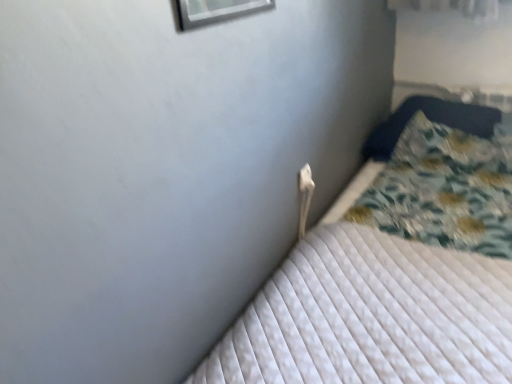
Question: Looking at their shapes, would you say fluffy blue pillow at right is wider or thinner than white plastic electric outlet at upper center?

Choices:
 (A) thin
 (B) wide

Answer: (B)

Question: Does point (418, 104) appear closer or farther from the camera than point (302, 183)?

Choices:
 (A) farther
 (B) closer

Answer: (A)

Question: Estimate the real-world distances between objects in this image. Which object is farther from the white plastic electric outlet at upper center?

Choices:
 (A) fluffy blue pillow at right
 (B) white quilted mattress at center

Answer: (A)

Question: Which object is the farthest from the white quilted mattress at center?

Choices:
 (A) white plastic electric outlet at upper center
 (B) fluffy blue pillow at right

Answer: (A)